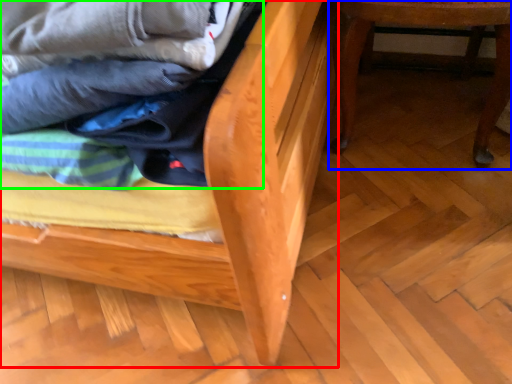
Question: Considering the real-world distances, which object is farthest from furniture (highlighted by a red box)? furniture (highlighted by a blue box) or laundry (highlighted by a green box)?

Choices:
 (A) furniture
 (B) laundry

Answer: (A)